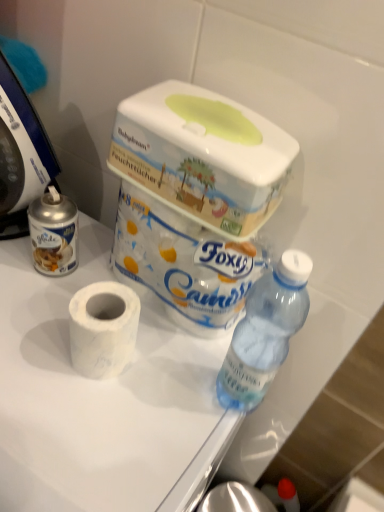
Measure the distance between white marble toilet paper at center, which is the 1th toilet paper in top-to-bottom order, and camera.

→ white marble toilet paper at center, which is the 1th toilet paper in top-to-bottom order, and camera are 20.02 inches apart.

At what (x,y) coordinates should I click in order to perform the action: click on white marble toilet paper at center, arranged as the second toilet paper when ordered from the bottom. Please return your answer as a coordinate pair (x, y). Looking at the image, I should click on (183, 263).

Measure the distance between point (83, 391) and camera.

Point (83, 391) is 20.00 inches from camera.

What are the coordinates of `white marble toilet paper at center, which is the 1th toilet paper in top-to-bottom order` in the screenshot? It's located at (183, 263).

Considering the relative positions of white marble toilet paper at center, which is the 1th toilet paper in top-to-bottom order, and white matte toilet paper at center in the image provided, is white marble toilet paper at center, which is the 1th toilet paper in top-to-bottom order, to the left or to the right of white matte toilet paper at center?

white marble toilet paper at center, which is the 1th toilet paper in top-to-bottom order, is to the right of white matte toilet paper at center.

From the image's perspective, is white marble toilet paper at center, arranged as the second toilet paper when ordered from the bottom, located beneath white matte toilet paper at center?

No, from the image's perspective, white marble toilet paper at center, arranged as the second toilet paper when ordered from the bottom, is not below white matte toilet paper at center.

From a real-world perspective, is white marble toilet paper at center, arranged as the second toilet paper when ordered from the bottom, positioned under white matte toilet paper at center based on gravity?

No, from a real-world perspective, white marble toilet paper at center, arranged as the second toilet paper when ordered from the bottom, is not under white matte toilet paper at center.

From a real-world perspective, which toilet paper is the 2nd one above the white matte toilet paper at center? Please provide its 2D coordinates.

[(183, 263)]

Measure the distance between blue plastic food processor at left and white marble toilet paper at center, arranged as the second toilet paper when ordered from the bottom.

blue plastic food processor at left and white marble toilet paper at center, arranged as the second toilet paper when ordered from the bottom, are 8.60 inches apart from each other.

From the image's perspective, which is above, blue plastic food processor at left or white marble toilet paper at center, which is the 1th toilet paper in top-to-bottom order?

blue plastic food processor at left, from the image's perspective.

In terms of height, does blue plastic food processor at left look taller or shorter compared to white marble toilet paper at center, which is the 1th toilet paper in top-to-bottom order?

Clearly, blue plastic food processor at left is taller compared to white marble toilet paper at center, which is the 1th toilet paper in top-to-bottom order.

Which is more to the left, blue plastic food processor at left or white marble toilet paper at center, which is the 1th toilet paper in top-to-bottom order?

Positioned to the left is blue plastic food processor at left.

Based on their sizes in the image, would you say white matte toilet paper at center, which ranks as the second toilet paper in top-to-bottom order, is bigger or smaller than white matte toilet paper at center?

Considering their sizes, white matte toilet paper at center, which ranks as the second toilet paper in top-to-bottom order, takes up less space than white matte toilet paper at center.

Is white matte toilet paper at center, which ranks as the second toilet paper in top-to-bottom order, surrounding white matte toilet paper at center?

Definitely not — white matte toilet paper at center is not inside white matte toilet paper at center, which ranks as the second toilet paper in top-to-bottom order.

Is white matte toilet paper at center, which is the 1th toilet paper from bottom to top, next to white matte toilet paper at center and touching it?

Indeed, white matte toilet paper at center, which is the 1th toilet paper from bottom to top, and white matte toilet paper at center are beside each other and touching.

In the scene shown: Which is more distant, [235,159] or [188,324]?

Point [188,324]

Considering the sizes of objects white plastic box at upper center and white marble toilet paper at center, which is the 1th toilet paper in top-to-bottom order, in the image provided, who is bigger, white plastic box at upper center or white marble toilet paper at center, which is the 1th toilet paper in top-to-bottom order,?

white marble toilet paper at center, which is the 1th toilet paper in top-to-bottom order.

From a real-world perspective, which object stands above the other?

white plastic box at upper center.

Considering the sizes of white matte toilet paper at center, which ranks as the second toilet paper in top-to-bottom order, and white marble toilet paper at center, which is the 1th toilet paper in top-to-bottom order, in the image, is white matte toilet paper at center, which ranks as the second toilet paper in top-to-bottom order, wider or thinner than white marble toilet paper at center, which is the 1th toilet paper in top-to-bottom order,?

In the image, white matte toilet paper at center, which ranks as the second toilet paper in top-to-bottom order, appears to be more narrow than white marble toilet paper at center, which is the 1th toilet paper in top-to-bottom order.

Is white marble toilet paper at center, arranged as the second toilet paper when ordered from the bottom, completely or partially inside white matte toilet paper at center, which ranks as the second toilet paper in top-to-bottom order?

No.

Is white matte toilet paper at center, which is the 1th toilet paper from bottom to top, facing away from white marble toilet paper at center, arranged as the second toilet paper when ordered from the bottom?

Yes, white matte toilet paper at center, which is the 1th toilet paper from bottom to top, is positioned with its back facing white marble toilet paper at center, arranged as the second toilet paper when ordered from the bottom.

Is point (88, 293) positioned before point (134, 275)?

Yes, it is.

Who is more distant, white plastic box at upper center or white matte toilet paper at center, which is the 1th toilet paper from bottom to top?

white matte toilet paper at center, which is the 1th toilet paper from bottom to top, is further from the camera.

Does point (219, 216) come in front of point (109, 332)?

Yes, point (219, 216) is closer to viewer.

From the image's perspective, would you say white plastic box at upper center is positioned over white matte toilet paper at center, which is the 1th toilet paper from bottom to top?

Indeed, from the image's perspective, white plastic box at upper center is shown above white matte toilet paper at center, which is the 1th toilet paper from bottom to top.

From a real-world perspective, which is physically above, white plastic box at upper center or white matte toilet paper at center, which is the 1th toilet paper from bottom to top?

white plastic box at upper center, from a real-world perspective.

Is white plastic box at upper center positioned with its back to white matte toilet paper at center?

No, white plastic box at upper center is not facing the opposite direction of white matte toilet paper at center.

Which is farther, (192, 141) or (85, 389)?

Positioned behind is point (85, 389).

In the scene shown: Between white plastic box at upper center and white matte toilet paper at center, which one appears on the left side from the viewer's perspective?

Positioned to the left is white matte toilet paper at center.

Find the location of a particular element. table in front of the white marble toilet paper at center, which is the 1th toilet paper in top-to-bottom order is located at coordinates (101, 399).

The image size is (384, 512). I want to click on food processor above the white marble toilet paper at center, arranged as the second toilet paper when ordered from the bottom (from a real-world perspective), so click(x=21, y=155).

Based on their spatial positions, is white plastic box at upper center or blue plastic food processor at left further from white matte toilet paper at center, which ranks as the second toilet paper in top-to-bottom order?

Among the two, blue plastic food processor at left is located further to white matte toilet paper at center, which ranks as the second toilet paper in top-to-bottom order.

Based on their spatial positions, is blue plastic food processor at left or white matte toilet paper at center further from white plastic box at upper center?

Based on the image, white matte toilet paper at center appears to be further to white plastic box at upper center.

Looking at the image, which one is located further to blue plastic food processor at left, white marble toilet paper at center, arranged as the second toilet paper when ordered from the bottom, or white matte toilet paper at center, which ranks as the second toilet paper in top-to-bottom order?

Based on the image, white matte toilet paper at center, which ranks as the second toilet paper in top-to-bottom order, appears to be further to blue plastic food processor at left.

Which object lies nearer to the anchor point white matte toilet paper at center, blue plastic food processor at left or white matte toilet paper at center, which is the 1th toilet paper from bottom to top?

The object closer to white matte toilet paper at center is white matte toilet paper at center, which is the 1th toilet paper from bottom to top.

Estimate the real-world distances between objects in this image. Which object is closer to white matte toilet paper at center, white marble toilet paper at center, arranged as the second toilet paper when ordered from the bottom, or white plastic box at upper center?

Among the two, white marble toilet paper at center, arranged as the second toilet paper when ordered from the bottom, is located nearer to white matte toilet paper at center.

When comparing their distances from white plastic box at upper center, does white marble toilet paper at center, arranged as the second toilet paper when ordered from the bottom, or blue plastic food processor at left seem closer?

Based on the image, white marble toilet paper at center, arranged as the second toilet paper when ordered from the bottom, appears to be nearer to white plastic box at upper center.

Which object lies nearer to the anchor point blue plastic food processor at left, white matte toilet paper at center or white matte toilet paper at center, which is the 1th toilet paper from bottom to top?

white matte toilet paper at center, which is the 1th toilet paper from bottom to top.

Which object lies nearer to the anchor point white marble toilet paper at center, which is the 1th toilet paper in top-to-bottom order, blue plastic food processor at left or white plastic box at upper center?

white plastic box at upper center.

Image resolution: width=384 pixels, height=512 pixels. What are the coordinates of `box between blue plastic food processor at left and white matte toilet paper at center from top to bottom` in the screenshot? It's located at (203, 156).

Locate an element on the screen. Image resolution: width=384 pixels, height=512 pixels. toilet paper between white marble toilet paper at center, which is the 1th toilet paper in top-to-bottom order, and white matte toilet paper at center vertically is located at coordinates (103, 328).

At what (x,y) coordinates should I click in order to perform the action: click on toilet paper between white plastic box at upper center and white matte toilet paper at center, which ranks as the second toilet paper in top-to-bottom order, vertically. Please return your answer as a coordinate pair (x, y). The height and width of the screenshot is (512, 384). Looking at the image, I should click on (183, 263).

You are a GUI agent. You are given a task and a screenshot of the screen. Output one action in this format:
    pyautogui.click(x=<x>, y=<y>)
    Task: Click on the toilet paper between blue plastic food processor at left and white marble toilet paper at center, which is the 1th toilet paper in top-to-bottom order, in the horizontal direction
    This screenshot has height=512, width=384.
    Given the screenshot: What is the action you would take?
    pyautogui.click(x=103, y=328)